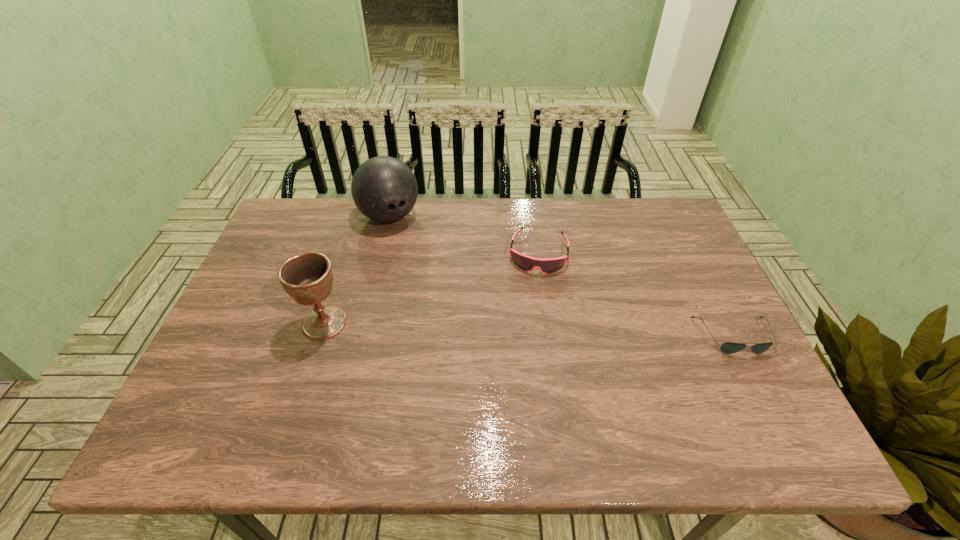
In order to click on vacant space at the right edge in this screenshot , I will do `click(694, 291)`.

I want to click on free region at the far left corner of the desktop, so click(x=299, y=215).

In order to click on vacant area at the near left corner of the desktop in this screenshot , I will do `click(245, 409)`.

This screenshot has height=540, width=960. Identify the location of free space between the shortest object and the chalice. 529,329.

Where is `free space between the bowling ball and the sunglasses`? The image size is (960, 540). free space between the bowling ball and the sunglasses is located at coordinates (562, 276).

The width and height of the screenshot is (960, 540). I want to click on unoccupied position between the chalice and the shortest object, so click(529, 329).

The width and height of the screenshot is (960, 540). I want to click on vacant point located between the rightmost object and the second shortest object, so click(636, 295).

Image resolution: width=960 pixels, height=540 pixels. What are the coordinates of `vacant point located between the goggles and the chalice` in the screenshot? It's located at (432, 288).

Where is `free space that is in between the third object from left to right and the sunglasses`? This screenshot has height=540, width=960. free space that is in between the third object from left to right and the sunglasses is located at coordinates (636, 295).

Find the location of a particular element. This screenshot has height=540, width=960. empty space that is in between the sunglasses and the second object from right to left is located at coordinates (636, 295).